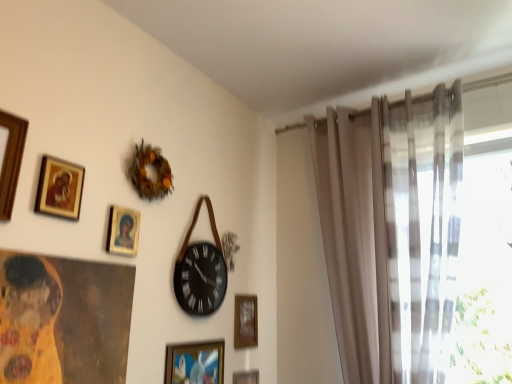
Question: From a real-world perspective, is sheer beige curtain at right physically below metallic gold picture frame at lower center, the fifth picture frame positioned from the left?

Choices:
 (A) yes
 (B) no

Answer: (B)

Question: Can you confirm if sheer beige curtain at right is positioned to the right of metallic gold picture frame at lower center, the sixth picture frame positioned from the top?

Choices:
 (A) yes
 (B) no

Answer: (A)

Question: Is sheer beige curtain at right facing towards metallic gold picture frame at lower center, which ranks as the second picture frame in right-to-left order?

Choices:
 (A) no
 (B) yes

Answer: (A)

Question: From the image's perspective, does sheer beige curtain at right appear higher than metallic gold picture frame at lower center, marked as the 5th picture frame in a front-to-back arrangement?

Choices:
 (A) yes
 (B) no

Answer: (A)

Question: From the image's perspective, is sheer beige curtain at right under metallic gold picture frame at lower center, which ranks as the second picture frame in right-to-left order?

Choices:
 (A) no
 (B) yes

Answer: (A)

Question: Is wooden picture frame at center, which is counted as the sixth picture frame, starting from the front, in front of or behind gold-framed picture at upper left, the 5th picture frame when ordered from right to left, in the image?

Choices:
 (A) front
 (B) behind

Answer: (B)

Question: From the image's perspective, is wooden picture frame at center, marked as the third picture frame in a bottom-to-top arrangement, above or below gold-framed picture at upper left, positioned as the 2th picture frame in top-to-bottom order?

Choices:
 (A) above
 (B) below

Answer: (B)

Question: Considering the positions of point (236, 301) and point (81, 167), is point (236, 301) closer or farther from the camera than point (81, 167)?

Choices:
 (A) farther
 (B) closer

Answer: (A)

Question: Choose the correct answer: Is wooden picture frame at center, marked as the third picture frame in a bottom-to-top arrangement, inside gold-framed picture at upper left, the second picture frame when ordered from left to right, or outside it?

Choices:
 (A) inside
 (B) outside

Answer: (B)

Question: In terms of width, does matte gold picture frame at upper center, acting as the 3th picture frame starting from the top, look wider or thinner when compared to gold-framed picture at lower center, the third picture frame in the right-to-left sequence?

Choices:
 (A) thin
 (B) wide

Answer: (A)

Question: Based on their sizes in the image, would you say matte gold picture frame at upper center, the fourth picture frame positioned from the right, is bigger or smaller than gold-framed picture at lower center, the 4th picture frame in the front-to-back sequence?

Choices:
 (A) small
 (B) big

Answer: (A)

Question: From a real-world perspective, relative to gold-framed picture at lower center, which appears as the 4th picture frame when viewed from the left, is matte gold picture frame at upper center, which ranks as the third picture frame in left-to-right order, vertically above or below?

Choices:
 (A) below
 (B) above

Answer: (B)

Question: Is point (123, 221) positioned closer to the camera than point (212, 360)?

Choices:
 (A) closer
 (B) farther

Answer: (A)

Question: Looking at the image, does wooden picture frame at center, placed as the 1th picture frame when sorted from back to front, seem bigger or smaller compared to wooden picture frame at upper left, which is the sixth picture frame in back-to-front order?

Choices:
 (A) small
 (B) big

Answer: (A)

Question: Considering the positions of wooden picture frame at center, placed as the 1th picture frame when sorted from back to front, and wooden picture frame at upper left, which ranks as the 6th picture frame in bottom-to-top order, in the image, is wooden picture frame at center, placed as the 1th picture frame when sorted from back to front, wider or thinner than wooden picture frame at upper left, which ranks as the 6th picture frame in bottom-to-top order,?

Choices:
 (A) wide
 (B) thin

Answer: (B)